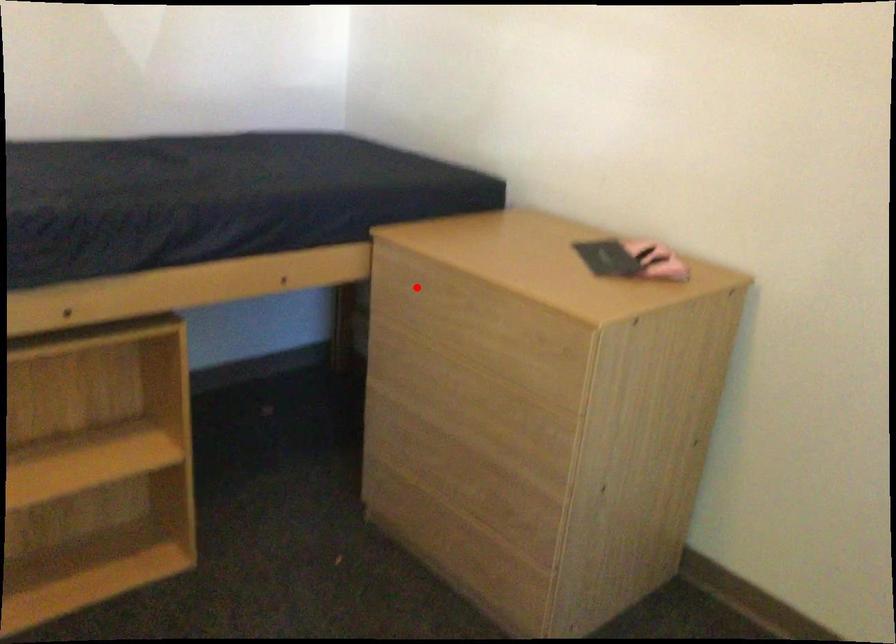
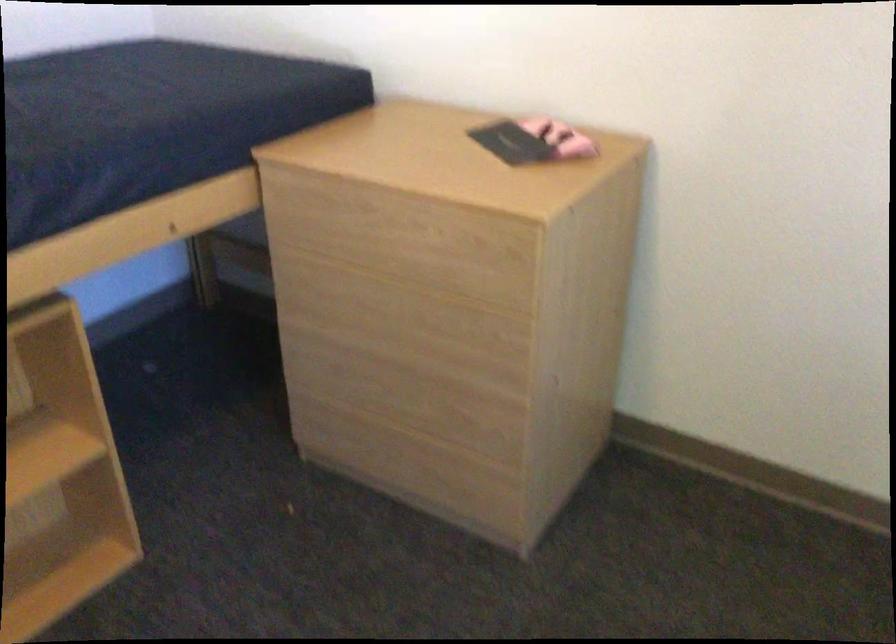
Where in the second image is the point corresponding to the highlighted location from the first image?

(324, 209)